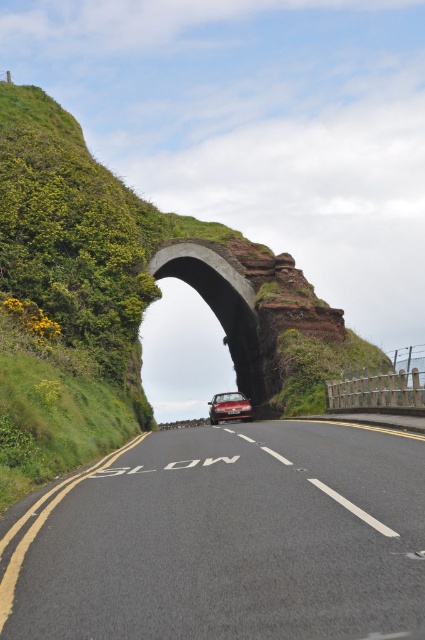
You are a driver approaching the road with a shiny metallic car at center. There is a green grassy hillside at upper left that might block your view. Can you see the road ahead clearly?

The green grassy hillside at upper left is positioned over the shiny metallic car at center, which means the hillside is blocking the view ahead of the shiny metallic car at center. Therefore, the driver may not have a clear view of the road ahead.

You are a driver approaching the scenic road with a shiny metallic car at center. The road has a painted warning sign. What is the size comparison between the black asphalt road at center and your car?

The black asphalt road at center is larger in size than the shiny metallic car at center, so the car can safely drive on the road without any size issues.

You are driving a shiny metallic car at center and want to make a U turn on the black asphalt road at center. Considering the road width, will you have enough space to complete the maneuver without crossing the double yellow lines?

The black asphalt road at center might be wider than shiny metallic car at center, so there is a possibility that the road is wide enough to allow a U turn without crossing the double yellow lines. However, the exact width is uncertain based on the given information.